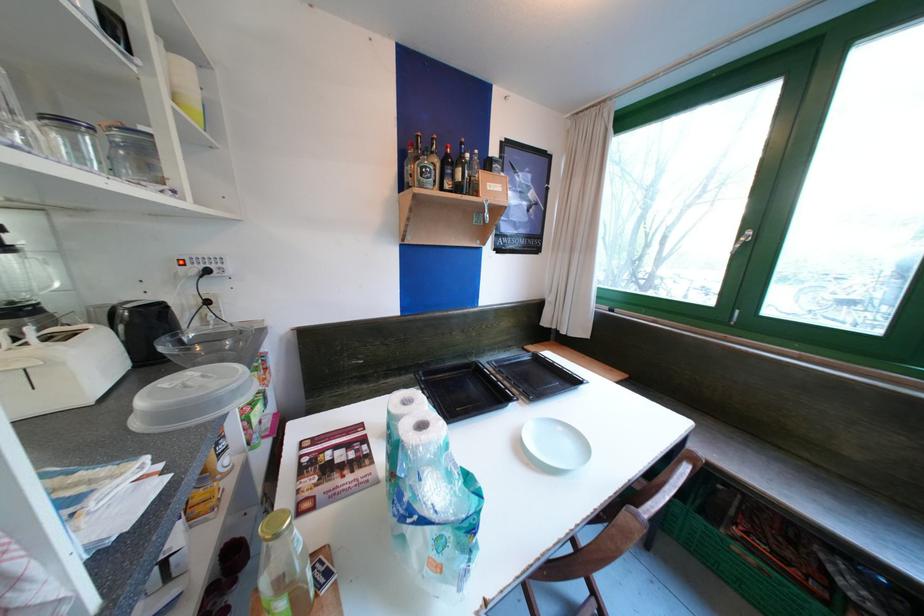
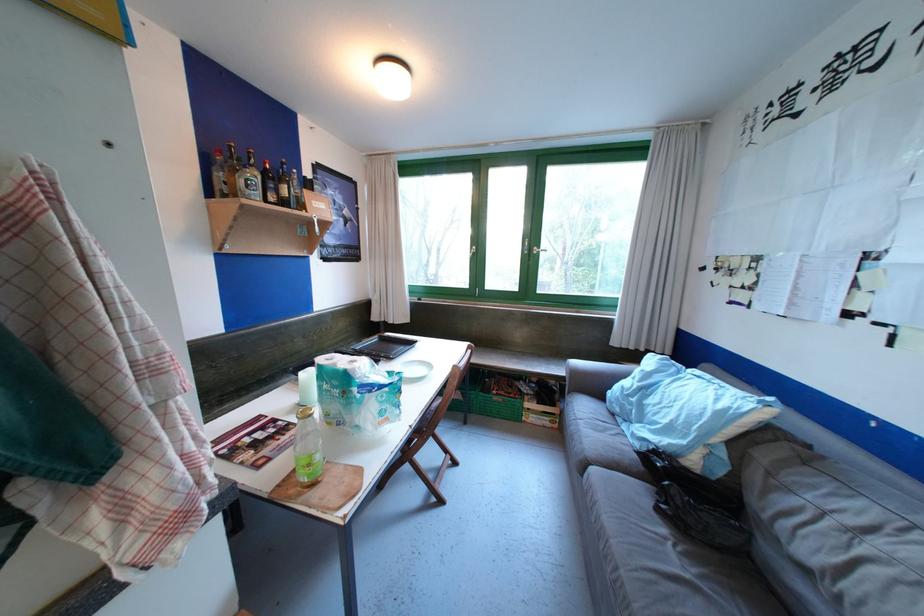
In the second image, find the point that corresponds to point 368,469 in the first image.

(296, 432)